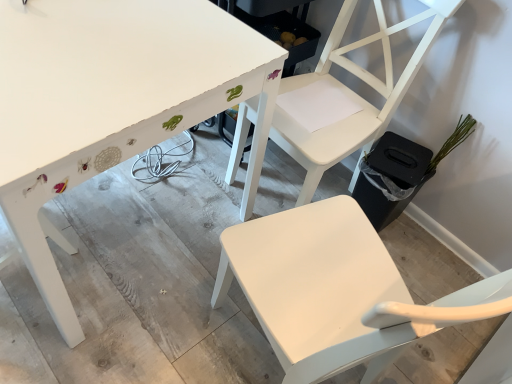
The width and height of the screenshot is (512, 384). What do you see at coordinates (337, 291) in the screenshot? I see `white matte chair at upper center, the 1th chair positioned from the bottom` at bounding box center [337, 291].

How much space does white matte chair at upper center, positioned as the 2th chair in top-to-bottom order, occupy vertically?

35.66 inches.

In order to face white matte chair at upper right, the 2th chair when ordered from bottom to top, should I rotate leftwards or rightwards?

Rotate right and turn 9.264 degrees.

I want to click on white painted wood table at upper left, so click(109, 102).

How different are the orientations of white matte chair at upper center, the 1th chair positioned from the bottom, and white matte chair at upper right, the 2th chair when ordered from bottom to top, in degrees?

The angle between the facing direction of white matte chair at upper center, the 1th chair positioned from the bottom, and the facing direction of white matte chair at upper right, the 2th chair when ordered from bottom to top, is 106 degrees.

From a real-world perspective, which is physically below, white matte chair at upper center, positioned as the 2th chair in top-to-bottom order, or white matte chair at upper right, which is the first chair in top-to-bottom order?

white matte chair at upper right, which is the first chair in top-to-bottom order, from a real-world perspective.

This screenshot has width=512, height=384. I want to click on chair on the right side of white matte chair at upper center, positioned as the 2th chair in top-to-bottom order, so click(x=345, y=96).

From the image's perspective, is white matte chair at upper center, positioned as the 2th chair in top-to-bottom order, above or below white matte chair at upper right, the 2th chair when ordered from bottom to top?

Clearly, from the image's perspective, white matte chair at upper center, positioned as the 2th chair in top-to-bottom order, is below white matte chair at upper right, the 2th chair when ordered from bottom to top.

Which object is closer to the camera taking this photo, green matte plant at right or white painted wood table at upper left?

white painted wood table at upper left is in front.

Would you say green matte plant at right is to the left or to the right of white painted wood table at upper left in the picture?

Clearly, green matte plant at right is on the right of white painted wood table at upper left in the image.

Considering the sizes of objects green matte plant at right and white painted wood table at upper left in the image provided, who is smaller, green matte plant at right or white painted wood table at upper left?

green matte plant at right is smaller.

What are the coordinates of `plant behind the white painted wood table at upper left` in the screenshot? It's located at (453, 140).

From a real-world perspective, is white painted wood table at upper left positioned over green matte plant at right based on gravity?

No, from a real-world perspective, white painted wood table at upper left is not over green matte plant at right

How much distance is there between white painted wood table at upper left and green matte plant at right?

The distance of white painted wood table at upper left from green matte plant at right is 1.08 meters.

From the image's perspective, is white painted wood table at upper left positioned above or below green matte plant at right?

From the image's perspective, white painted wood table at upper left appears above green matte plant at right.

How many degrees apart are the facing directions of white painted wood table at upper left and green matte plant at right?

white painted wood table at upper left and green matte plant at right are facing 3.48 degrees away from each other.

Consider the image. Between green matte plant at right and white matte chair at upper center, positioned as the 2th chair in top-to-bottom order, which one appears on the right side from the viewer's perspective?

green matte plant at right.

Is point (452, 138) in front of point (302, 239)?

That is False.

From the image's perspective, is green matte plant at right over white matte chair at upper center, positioned as the 2th chair in top-to-bottom order?

Yes, from the image's perspective, green matte plant at right is on top of white matte chair at upper center, positioned as the 2th chair in top-to-bottom order.

Considering the relative positions of green matte plant at right and white matte chair at upper center, the 1th chair positioned from the bottom, in the image provided, is green matte plant at right in front of white matte chair at upper center, the 1th chair positioned from the bottom,?

No, the depth of green matte plant at right is greater than that of white matte chair at upper center, the 1th chair positioned from the bottom.

Would you consider white matte chair at upper right, the 2th chair when ordered from bottom to top, to be distant from white painted wood table at upper left?

They are positioned close to each other.

Can you confirm if white matte chair at upper right, the 2th chair when ordered from bottom to top, is bigger than white painted wood table at upper left?

No.

Which object is more forward, white matte chair at upper right, which is the first chair in top-to-bottom order, or white painted wood table at upper left?

white painted wood table at upper left.

Who is shorter, white matte chair at upper right, which is the first chair in top-to-bottom order, or white painted wood table at upper left?

white painted wood table at upper left.

Which object is positioned more to the right, white matte chair at upper right, which is the first chair in top-to-bottom order, or green matte plant at right?

Positioned to the right is green matte plant at right.

What's the angular difference between white matte chair at upper right, the 2th chair when ordered from bottom to top, and green matte plant at right's facing directions?

The angular difference between white matte chair at upper right, the 2th chair when ordered from bottom to top, and green matte plant at right is 0.000974 degrees.

In the image, is white matte chair at upper right, the 2th chair when ordered from bottom to top, positioned in front of or behind green matte plant at right?

Clearly, white matte chair at upper right, the 2th chair when ordered from bottom to top, is in front of green matte plant at right.

Does white matte chair at upper right, the 2th chair when ordered from bottom to top, have a lesser width compared to green matte plant at right?

No.

From the picture: Is white painted wood table at upper left wider than white matte chair at upper right, which is the first chair in top-to-bottom order?

Yes.

From a real-world perspective, which object stands above the other?

white matte chair at upper right, the 2th chair when ordered from bottom to top, from a real-world perspective.

Is white painted wood table at upper left not within white matte chair at upper right, which is the first chair in top-to-bottom order?

Indeed, white painted wood table at upper left is completely outside white matte chair at upper right, which is the first chair in top-to-bottom order.

Is white painted wood table at upper left far from white matte chair at upper right, which is the first chair in top-to-bottom order?

No, white painted wood table at upper left is not far away from white matte chair at upper right, which is the first chair in top-to-bottom order.

Where is `chair below the white matte chair at upper center, positioned as the 2th chair in top-to-bottom order (from a real-world perspective)`? The height and width of the screenshot is (384, 512). chair below the white matte chair at upper center, positioned as the 2th chair in top-to-bottom order (from a real-world perspective) is located at coordinates (345, 96).

Identify the location of plant behind the white painted wood table at upper left. The height and width of the screenshot is (384, 512). (453, 140).

Which object lies further to the anchor point green matte plant at right, white matte chair at upper right, which is the first chair in top-to-bottom order, or white matte chair at upper center, positioned as the 2th chair in top-to-bottom order?

white matte chair at upper center, positioned as the 2th chair in top-to-bottom order, lies further to green matte plant at right than the other object.

In the scene shown: Which object lies nearer to the anchor point white matte chair at upper center, the 1th chair positioned from the bottom, green matte plant at right or white matte chair at upper right, which is the first chair in top-to-bottom order?

Based on the image, white matte chair at upper right, which is the first chair in top-to-bottom order, appears to be nearer to white matte chair at upper center, the 1th chair positioned from the bottom.

Considering their positions, is white painted wood table at upper left positioned further to white matte chair at upper center, the 1th chair positioned from the bottom, than green matte plant at right?

Among the two, green matte plant at right is located further to white matte chair at upper center, the 1th chair positioned from the bottom.

When comparing their distances from white matte chair at upper right, the 2th chair when ordered from bottom to top, does white painted wood table at upper left or white matte chair at upper center, positioned as the 2th chair in top-to-bottom order, seem closer?

Based on the image, white painted wood table at upper left appears to be nearer to white matte chair at upper right, the 2th chair when ordered from bottom to top.

Looking at this image, when comparing their distances from white matte chair at upper right, the 2th chair when ordered from bottom to top, does white painted wood table at upper left or green matte plant at right seem further?

green matte plant at right.

Estimate the real-world distances between objects in this image. Which object is closer to white matte chair at upper right, the 2th chair when ordered from bottom to top, green matte plant at right or white painted wood table at upper left?

The object closer to white matte chair at upper right, the 2th chair when ordered from bottom to top, is white painted wood table at upper left.

Estimate the real-world distances between objects in this image. Which object is further from white matte chair at upper right, which is the first chair in top-to-bottom order, white matte chair at upper center, positioned as the 2th chair in top-to-bottom order, or white painted wood table at upper left?

Based on the image, white matte chair at upper center, positioned as the 2th chair in top-to-bottom order, appears to be further to white matte chair at upper right, which is the first chair in top-to-bottom order.

Looking at the image, which one is located closer to white painted wood table at upper left, white matte chair at upper right, the 2th chair when ordered from bottom to top, or green matte plant at right?

The object closer to white painted wood table at upper left is white matte chair at upper right, the 2th chair when ordered from bottom to top.

Locate an element on the screen. chair between white painted wood table at upper left and white matte chair at upper right, which is the first chair in top-to-bottom order, in the horizontal direction is located at coordinates (337, 291).

Locate an element on the screen. chair between white matte chair at upper center, the 1th chair positioned from the bottom, and green matte plant at right from front to back is located at coordinates (345, 96).